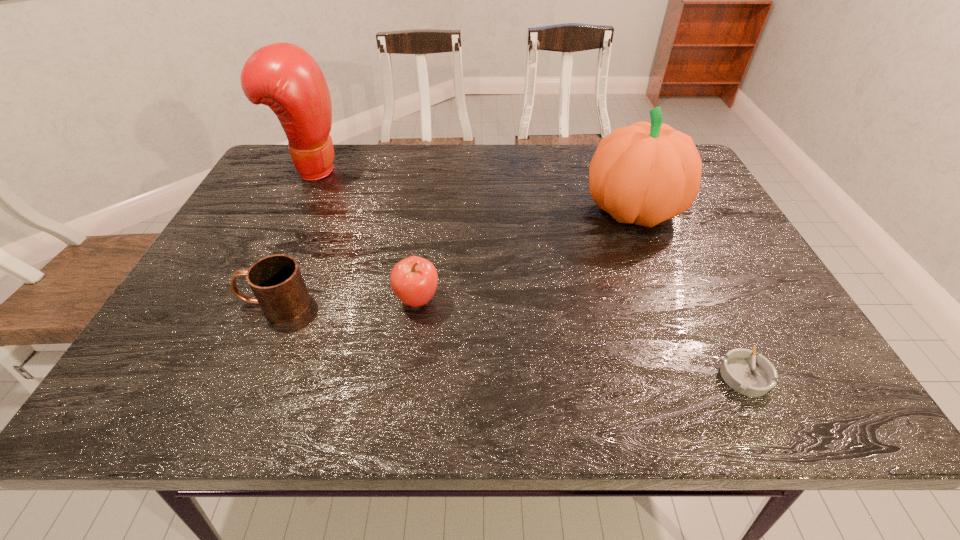
Locate an element on the screen. The height and width of the screenshot is (540, 960). boxing glove is located at coordinates (283, 76).

Locate an element on the screen. The image size is (960, 540). the fourth shortest object is located at coordinates (646, 173).

Locate an element on the screen. The image size is (960, 540). apple is located at coordinates (414, 280).

Locate an element on the screen. This screenshot has height=540, width=960. the third shortest object is located at coordinates (414, 280).

The width and height of the screenshot is (960, 540). I want to click on the fourth tallest object, so click(x=276, y=281).

In order to click on ashtray in this screenshot , I will do `click(754, 376)`.

Identify the location of the shortest object. This screenshot has height=540, width=960. (754, 376).

You are a GUI agent. You are given a task and a screenshot of the screen. Output one action in this format:
    pyautogui.click(x=<x>, y=<y>)
    Task: Click on the free space located 0.150m on the striking surface of the boxing glove
    The image size is (960, 540).
    Given the screenshot: What is the action you would take?
    pyautogui.click(x=396, y=169)

Where is `vacant space located 0.180m on the front of the pumpkin`? vacant space located 0.180m on the front of the pumpkin is located at coordinates (668, 298).

Find the location of a particular element. vacant region located 0.210m on the front of the third object from left to right is located at coordinates (402, 409).